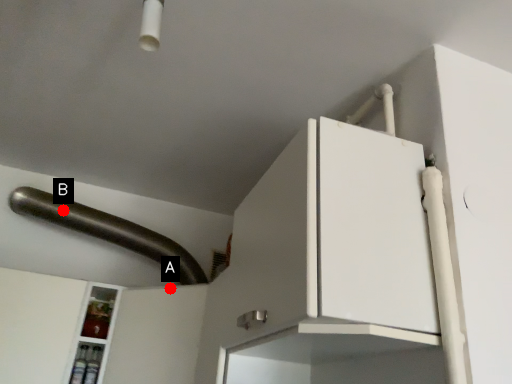
Question: Two points are circled on the image, labeled by A and B beside each circle. Which of the following is the closest to the observer?

Choices:
 (A) A is closer
 (B) B is closer

Answer: (A)